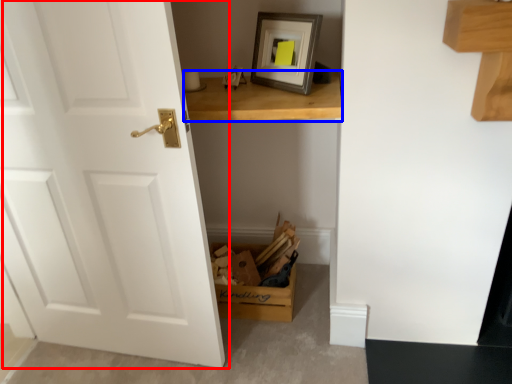
Question: Among these objects, which one is farthest to the camera, door (highlighted by a red box) or table (highlighted by a blue box)?

Choices:
 (A) door
 (B) table

Answer: (B)